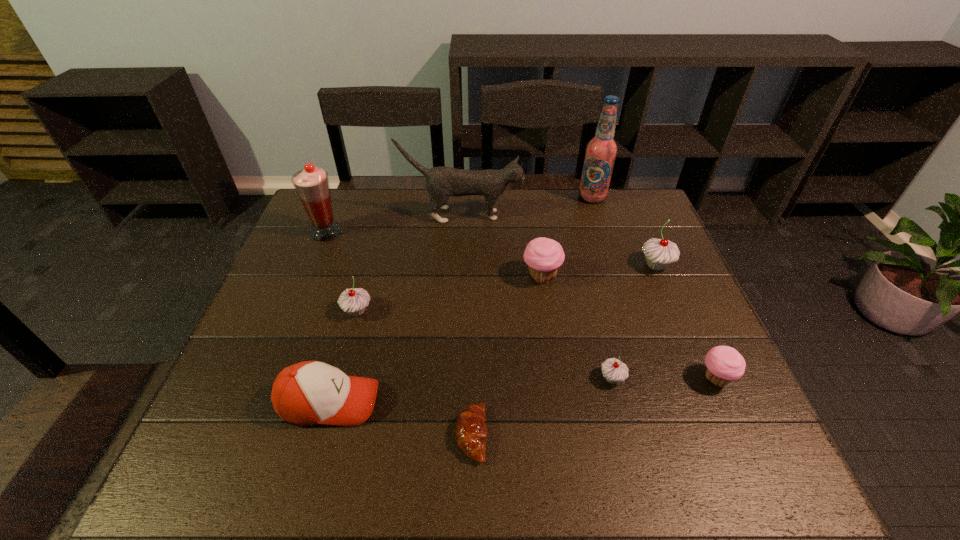
Locate an element on the screen. Image resolution: width=960 pixels, height=540 pixels. free space that is in between the blue alcohol and the sixth farthest object is located at coordinates (474, 254).

Identify which object is the sixth nearest to the bigger pink cupcake. Please provide its 2D coordinates. Your answer should be formatted as a tuple, i.e. [(x, y)], where the tuple contains the x and y coordinates of a point satisfying the conditions above.

[(471, 431)]

Locate which object is the closest to the tallest object. Please provide its 2D coordinates. Your answer should be formatted as a tuple, i.e. [(x, y)], where the tuple contains the x and y coordinates of a point satisfying the conditions above.

[(442, 182)]

Locate an element on the screen. The image size is (960, 540). cupcake identified as the closest to the red smoothie is located at coordinates (354, 301).

At what (x,y) coordinates should I click in order to perform the action: click on cupcake that stands as the fourth closest to the tallest cupcake. Please return your answer as a coordinate pair (x, y). The image size is (960, 540). Looking at the image, I should click on (354, 301).

The image size is (960, 540). What are the coordinates of `gray cupcake that stands as the closest to the orange baseball cap` in the screenshot? It's located at (354, 301).

What are the coordinates of `the closest gray cupcake to the baseball cap` in the screenshot? It's located at (354, 301).

Where is `vacant position in the image that satisfies the following two spatial constraints: 1. at the face of the cat; 2. on the back side of the fourth cupcake from right to left`? vacant position in the image that satisfies the following two spatial constraints: 1. at the face of the cat; 2. on the back side of the fourth cupcake from right to left is located at coordinates pos(459,276).

You are a GUI agent. You are given a task and a screenshot of the screen. Output one action in this format:
    pyautogui.click(x=<x>, y=<y>)
    Task: Click on the free spot that satisfies the following two spatial constraints: 1. on the back side of the leftmost gray cupcake; 2. on the right side of the farthest object
    
    Given the screenshot: What is the action you would take?
    pyautogui.click(x=388, y=197)

This screenshot has width=960, height=540. I want to click on blank space that satisfies the following two spatial constraints: 1. on the back side of the tallest object; 2. on the left side of the fifth nearest object, so click(x=388, y=197).